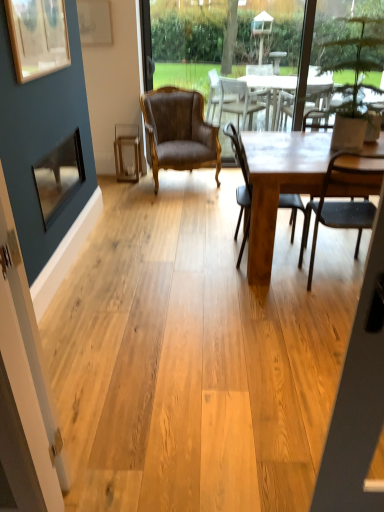
This screenshot has height=512, width=384. What do you see at coordinates (30, 370) in the screenshot?
I see `transparent glass screen door at left` at bounding box center [30, 370].

In order to face wooden picture frame at upper left, the third picture frame in the back-to-front sequence, should I rotate leftwards or rightwards?

To align with it, rotate left about 19.152°.

This screenshot has height=512, width=384. What do you see at coordinates (179, 132) in the screenshot? I see `brown leather armchair at center, acting as the 3th chair starting from the right` at bounding box center [179, 132].

The height and width of the screenshot is (512, 384). Describe the element at coordinates (184, 44) in the screenshot. I see `brown leather chair at center` at that location.

What is the approximate width of brown leather chair at center?

brown leather chair at center is 5.53 inches wide.

What is the approximate width of wooden table at center?

It is 1.19 meters.

What is the approximate width of matte brown chair at center, the 1th chair when ordered from right to left?

23.27 inches.

Where is `transparent glass screen door at left`? Image resolution: width=384 pixels, height=512 pixels. transparent glass screen door at left is located at coordinates (30, 370).

Is point (47, 195) farther from camera compared to point (172, 139)?

No.

In the scene shown: Which of these two, metallic glass picture frame at left, marked as the 3th picture frame in a top-to-bottom arrangement, or brown leather armchair at center, acting as the 1th chair starting from the left, is thinner?

With smaller width is metallic glass picture frame at left, marked as the 3th picture frame in a top-to-bottom arrangement.

Which object is positioned more to the right, metallic glass picture frame at left, the 1th picture frame when ordered from bottom to top, or brown leather armchair at center, acting as the first chair starting from the back?

brown leather armchair at center, acting as the first chair starting from the back, is more to the right.

Which of these two, transparent glass screen door at left or brown leather armchair at center, acting as the first chair starting from the back, stands shorter?

With less height is brown leather armchair at center, acting as the first chair starting from the back.

I want to click on screen door below the brown leather armchair at center, acting as the 1th chair starting from the left (from the image's perspective), so click(x=30, y=370).

From the image's perspective, is transparent glass screen door at left above or below brown leather armchair at center, which is the third chair in front-to-back order?

From the image's perspective, transparent glass screen door at left appears below brown leather armchair at center, which is the third chair in front-to-back order.

From a real-world perspective, does transparent glass screen door at left sit lower than brown leather armchair at center, which is the third chair in front-to-back order?

No, from a real-world perspective, transparent glass screen door at left is not below brown leather armchair at center, which is the third chair in front-to-back order.

Could you measure the distance between wooden picture frame at upper left, which appears as the 1th picture frame when viewed from the front, and matte brown chair at center, the first chair in the front-to-back sequence?

They are 1.87 meters apart.

Could matte brown chair at center, which ranks as the third chair in left-to-right order, be considered to be inside wooden picture frame at upper left, which ranks as the second picture frame in top-to-bottom order?

No, matte brown chair at center, which ranks as the third chair in left-to-right order, is located outside of wooden picture frame at upper left, which ranks as the second picture frame in top-to-bottom order.

From the image's perspective, between wooden picture frame at upper left, which ranks as the second picture frame in top-to-bottom order, and matte brown chair at center, the first chair in the front-to-back sequence, which one is located above?

wooden picture frame at upper left, which ranks as the second picture frame in top-to-bottom order, from the image's perspective.

Is the depth of wooden picture frame at upper left, which ranks as the second picture frame in bottom-to-top order, less than that of matte brown chair at center, which ranks as the third chair in left-to-right order?

Yes, wooden picture frame at upper left, which ranks as the second picture frame in bottom-to-top order, is closer to the camera.

In the scene shown: Does brown leather armchair at center, acting as the first chair starting from the back, touch matte brown chair at center, the second chair in the back-to-front sequence?

No, brown leather armchair at center, acting as the first chair starting from the back, is not making contact with matte brown chair at center, the second chair in the back-to-front sequence.

Considering the sizes of objects brown leather armchair at center, acting as the 1th chair starting from the left, and matte brown chair at center, the second chair in the back-to-front sequence, in the image provided, who is bigger, brown leather armchair at center, acting as the 1th chair starting from the left, or matte brown chair at center, the second chair in the back-to-front sequence,?

With larger size is brown leather armchair at center, acting as the 1th chair starting from the left.

From a real-world perspective, which object rests below the other?

matte brown chair at center, the second chair in the back-to-front sequence, from a real-world perspective.

Between transparent glass screen door at left and brown leather chair at center, which one has larger width?

brown leather chair at center is wider.

From the picture: Considering the positions of objects transparent glass screen door at left and brown leather chair at center in the image provided, who is behind, transparent glass screen door at left or brown leather chair at center?

brown leather chair at center.

From a real-world perspective, is transparent glass screen door at left located higher than brown leather chair at center?

Incorrect, from a real-world perspective, transparent glass screen door at left is lower than brown leather chair at center.

In terms of height, does transparent glass screen door at left look taller or shorter compared to brown leather chair at center?

Considering their sizes, transparent glass screen door at left has less height than brown leather chair at center.

From a real-world perspective, does matte brown chair at center, placed as the 2th chair when sorted from front to back, stand above metallic glass picture frame at left, which is the 2th picture frame in front-to-back order?

No, from a real-world perspective, matte brown chair at center, placed as the 2th chair when sorted from front to back, is not on top of metallic glass picture frame at left, which is the 2th picture frame in front-to-back order.

From the image's perspective, is matte brown chair at center, the second chair viewed from the left, above or below metallic glass picture frame at left, marked as the 3th picture frame in a top-to-bottom arrangement?

Based on their image positions, matte brown chair at center, the second chair viewed from the left, is located beneath metallic glass picture frame at left, marked as the 3th picture frame in a top-to-bottom arrangement.

From the image's perspective, which picture frame is the 1st one above the matte brown chair at center, the second chair viewed from the left? Please provide its 2D coordinates.

[(58, 176)]

Who is taller, matte brown chair at center, the second chair in the back-to-front sequence, or metallic glass picture frame at left, marked as the second picture frame in a back-to-front arrangement?

With more height is matte brown chair at center, the second chair in the back-to-front sequence.

Is matte brown chair at center, the second chair viewed from the left, next to wooden picture frame at upper left, which ranks as the second picture frame in top-to-bottom order, and touching it?

No.

There is a matte brown chair at center, the second chair viewed from the left. Find the location of `the 2nd picture frame above it (from a real-world perspective)`. the 2nd picture frame above it (from a real-world perspective) is located at coordinates (37, 37).

Image resolution: width=384 pixels, height=512 pixels. Find the location of `chair above the metallic glass picture frame at left, the 1th picture frame when ordered from bottom to top (from the image's perspective)`. chair above the metallic glass picture frame at left, the 1th picture frame when ordered from bottom to top (from the image's perspective) is located at coordinates (179, 132).

Where is `the 1st chair to the right of the transparent glass screen door at left, counting from the anchor's position`? The width and height of the screenshot is (384, 512). the 1st chair to the right of the transparent glass screen door at left, counting from the anchor's position is located at coordinates (179, 132).

Considering their positions, is matte brown chair at center, the 1th chair when ordered from right to left, positioned closer to wooden picture frame at upper left, the third picture frame in the back-to-front sequence, than brown leather armchair at center, acting as the first chair starting from the back?

brown leather armchair at center, acting as the first chair starting from the back, is closer to wooden picture frame at upper left, the third picture frame in the back-to-front sequence.

Based on their spatial positions, is wooden table at center or matte brown chair at center, which appears as the third chair when viewed from the back, closer to matte brown chair at center, the second chair viewed from the left?

wooden table at center is closer to matte brown chair at center, the second chair viewed from the left.

Looking at the image, which one is located closer to brown leather chair at center, wooden table at center or matte brown chair at center, which is the 2th chair from right to left?

wooden table at center.

From the image, which object appears to be farther from transparent glass screen door at left, brown leather armchair at center, acting as the 1th chair starting from the left, or matte brown chair at center, the 1th chair when ordered from right to left?

brown leather armchair at center, acting as the 1th chair starting from the left.

Considering their positions, is brown leather armchair at center, which is the third chair in front-to-back order, positioned closer to matte gold picture frame at upper left, the third picture frame viewed from the front, than matte brown chair at center, the 1th chair when ordered from right to left?

brown leather armchair at center, which is the third chair in front-to-back order.

Considering their positions, is wooden picture frame at upper left, which ranks as the second picture frame in bottom-to-top order, positioned closer to brown leather armchair at center, which is the third chair in front-to-back order, than matte brown chair at center, which ranks as the third chair in left-to-right order?

matte brown chair at center, which ranks as the third chair in left-to-right order.

When comparing their distances from matte brown chair at center, placed as the 2th chair when sorted from front to back, does brown leather chair at center or matte brown chair at center, which appears as the third chair when viewed from the back, seem further?

Based on the image, brown leather chair at center appears to be further to matte brown chair at center, placed as the 2th chair when sorted from front to back.

Looking at the image, which one is located closer to transparent glass screen door at left, metallic glass picture frame at left, marked as the 3th picture frame in a top-to-bottom arrangement, or matte brown chair at center, the second chair viewed from the left?

Based on the image, metallic glass picture frame at left, marked as the 3th picture frame in a top-to-bottom arrangement, appears to be nearer to transparent glass screen door at left.

Find the location of a particular element. This screenshot has height=512, width=384. kitchen & dining room table between transparent glass screen door at left and matte brown chair at center, the first chair in the front-to-back sequence, from left to right is located at coordinates (278, 184).

You are a GUI agent. You are given a task and a screenshot of the screen. Output one action in this format:
    pyautogui.click(x=<x>, y=<y>)
    Task: Click on the kitchen & dining room table between transparent glass screen door at left and brown leather armchair at center, acting as the 1th chair starting from the left, along the z-axis
    Image resolution: width=384 pixels, height=512 pixels.
    Given the screenshot: What is the action you would take?
    pyautogui.click(x=278, y=184)

This screenshot has width=384, height=512. I want to click on chair between matte gold picture frame at upper left, the first picture frame from the back, and brown leather chair at center, in the horizontal direction, so click(x=179, y=132).

The height and width of the screenshot is (512, 384). I want to click on chair situated between metallic glass picture frame at left, marked as the second picture frame in a back-to-front arrangement, and matte brown chair at center, placed as the 2th chair when sorted from front to back, from left to right, so click(179, 132).